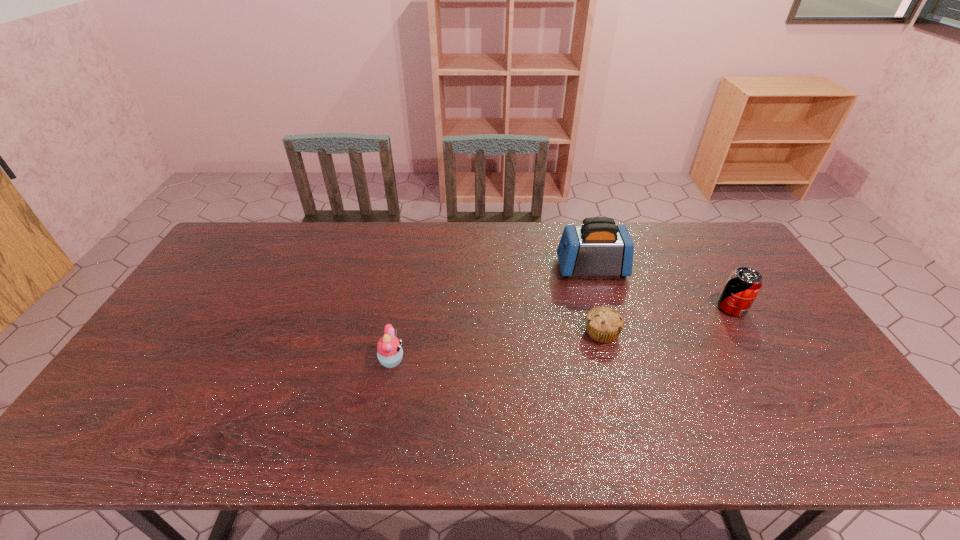
Where is `free spot between the farthest object and the muffin`? The height and width of the screenshot is (540, 960). free spot between the farthest object and the muffin is located at coordinates (597, 300).

Find the location of a particular element. The image size is (960, 540). empty space that is in between the third nearest object and the shortest object is located at coordinates (667, 320).

Locate an element on the screen. This screenshot has height=540, width=960. free space between the farthest object and the second shortest object is located at coordinates (492, 315).

The image size is (960, 540). Find the location of `vacant area that lies between the shortest object and the rightmost object`. vacant area that lies between the shortest object and the rightmost object is located at coordinates (667, 320).

Identify the location of free space between the toaster and the cupcake. (492, 315).

At what (x,y) coordinates should I click in order to perform the action: click on vacant area that lies between the tallest object and the third shortest object. Please return your answer as a coordinate pair (x, y). The image size is (960, 540). Looking at the image, I should click on pyautogui.click(x=661, y=288).

Image resolution: width=960 pixels, height=540 pixels. In order to click on free space between the leftmost object and the toaster in this screenshot , I will do `click(492, 315)`.

I want to click on vacant area that lies between the shortest object and the rightmost object, so click(667, 320).

You are a GUI agent. You are given a task and a screenshot of the screen. Output one action in this format:
    pyautogui.click(x=<x>, y=<y>)
    Task: Click on the free space between the second shortest object and the rightmost object
    The image size is (960, 540).
    Given the screenshot: What is the action you would take?
    pyautogui.click(x=562, y=335)

Find the location of `unoccupied position between the third nearest object and the tallest object`. unoccupied position between the third nearest object and the tallest object is located at coordinates (661, 288).